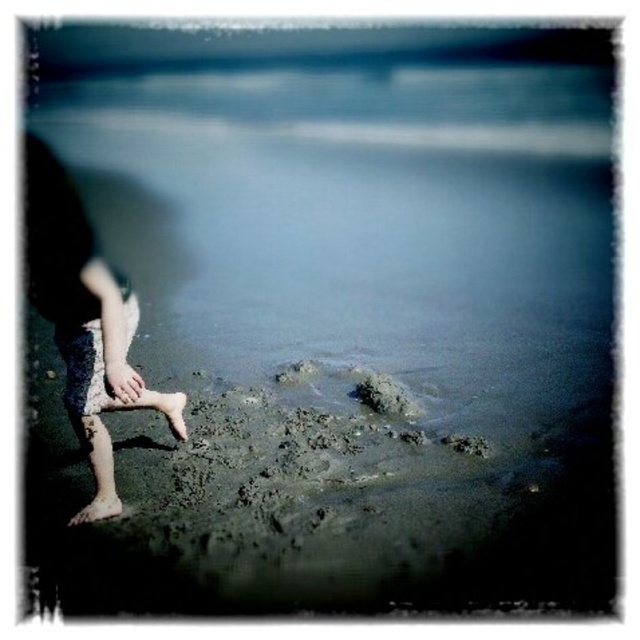
You are standing at the beach and see two points marked on the sand. The first point is at coordinate point(51, 266) and the second is at point(86, 508). If you walk towards the water, which point will you step on first?

Point(51, 266) is in front of point(86, 508), so you will step on point(51, 266) first as you walk towards the water.

You are a photographer trying to capture the exact spot where the barefoot sand at lower left was located. Based on the coordinates given, can you determine if the spot is closer to the center of the image or the edge?

The coordinates of the barefoot sand at lower left are at point 0.644 on the x axis and 0.269 on the y axis. Since both values are less than 0.5, the spot is closer to the lower left edge of the image rather than the center.